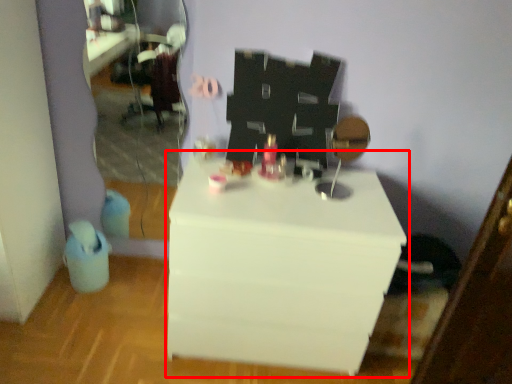
Question: Considering the relative positions of table (annotated by the red box) and mirror in the image provided, where is table (annotated by the red box) located with respect to the staircase?

Choices:
 (A) right
 (B) left

Answer: (A)